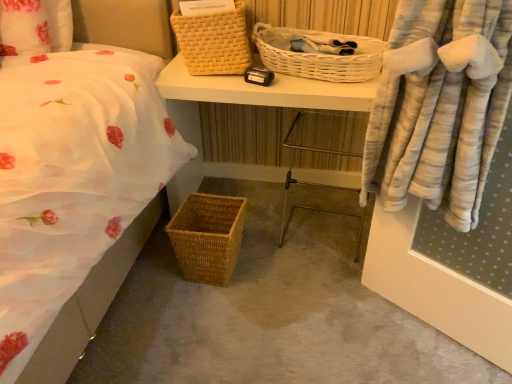
The image size is (512, 384). Identify the location of free region under woven wood desk at center (from a real-world perspective). (269, 200).